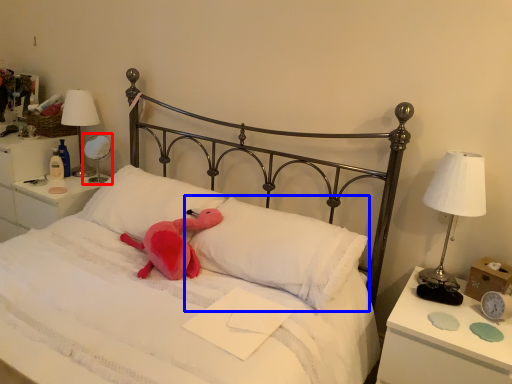
Question: Which object is further to the camera taking this photo, bedside lamp (highlighted by a red box) or pillow (highlighted by a blue box)?

Choices:
 (A) bedside lamp
 (B) pillow

Answer: (A)